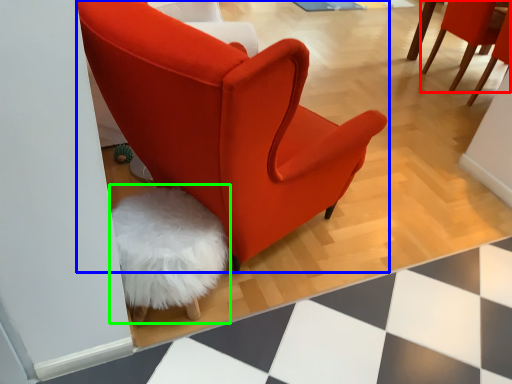
Question: Estimate the real-world distances between objects in this image. Which object is farther from chair (highlighted by a red box), chair (highlighted by a blue box) or swivel chair (highlighted by a green box)?

Choices:
 (A) chair
 (B) swivel chair

Answer: (B)